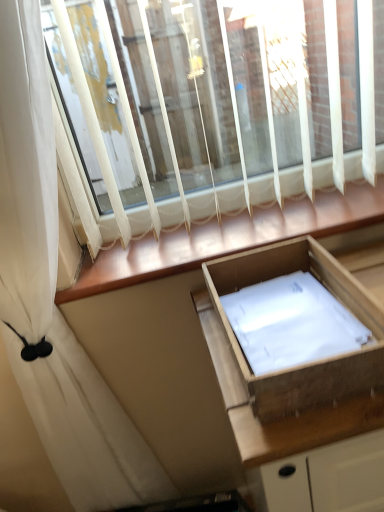
Question: Does wooden drawer at center appear on the left side of white sheer curtain at upper left?

Choices:
 (A) yes
 (B) no

Answer: (B)

Question: From the image's perspective, would you say wooden drawer at center is shown under white sheer curtain at upper left?

Choices:
 (A) yes
 (B) no

Answer: (A)

Question: Can you confirm if wooden drawer at center is shorter than white sheer curtain at upper left?

Choices:
 (A) yes
 (B) no

Answer: (A)

Question: Is wooden drawer at center at the right side of white sheer curtain at upper left?

Choices:
 (A) no
 (B) yes

Answer: (B)

Question: Can we say wooden drawer at center lies outside white sheer curtain at upper left?

Choices:
 (A) no
 (B) yes

Answer: (B)

Question: Is wooden drawer at center facing away from white sheer curtain at upper left?

Choices:
 (A) yes
 (B) no

Answer: (B)

Question: Considering the relative sizes of wooden drawer at center and wooden at lower center in the image provided, is wooden drawer at center thinner than wooden at lower center?

Choices:
 (A) no
 (B) yes

Answer: (A)

Question: Does wooden drawer at center turn towards wooden at lower center?

Choices:
 (A) yes
 (B) no

Answer: (B)

Question: From the image's perspective, is wooden drawer at center above wooden at lower center?

Choices:
 (A) no
 (B) yes

Answer: (A)

Question: Is the position of wooden drawer at center less distant than that of wooden at lower center?

Choices:
 (A) yes
 (B) no

Answer: (A)

Question: Is wooden drawer at center next to wooden at lower center and touching it?

Choices:
 (A) yes
 (B) no

Answer: (B)

Question: Can you confirm if wooden drawer at center is shorter than wooden at lower center?

Choices:
 (A) no
 (B) yes

Answer: (A)

Question: Is white sheer curtain at upper left wider than wooden at lower center?

Choices:
 (A) no
 (B) yes

Answer: (A)